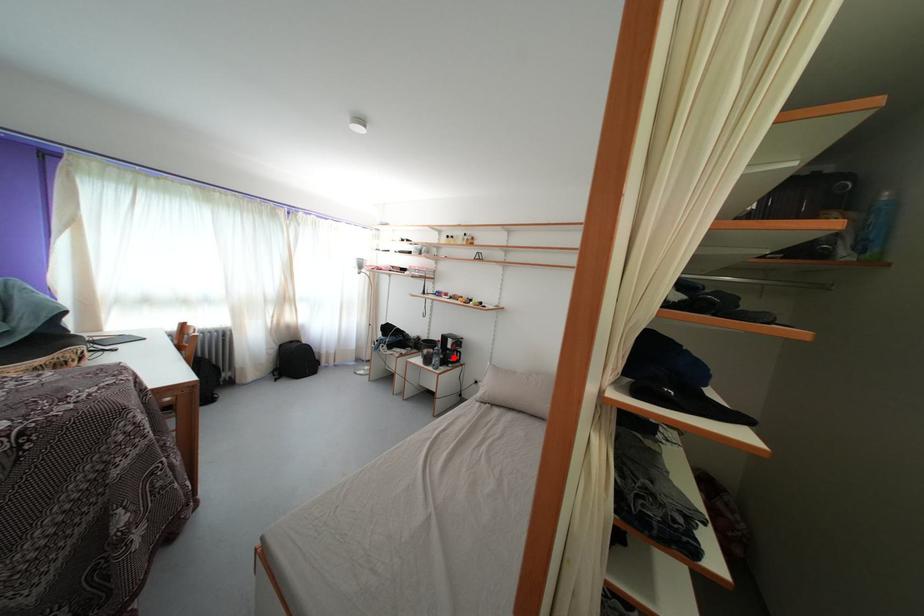
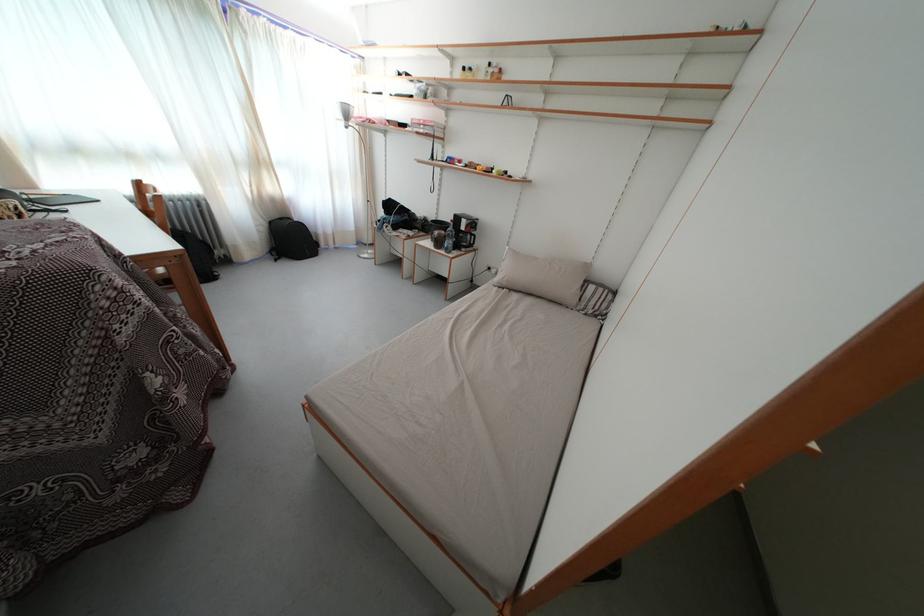
Question: I am providing you with two images of the same scene from different viewpoints. Given a red point in image1, look at the same physical point in image2. Is it:

Choices:
 (A) Closer to the viewpoint
 (B) Farther from the viewpoint

Answer: (A)